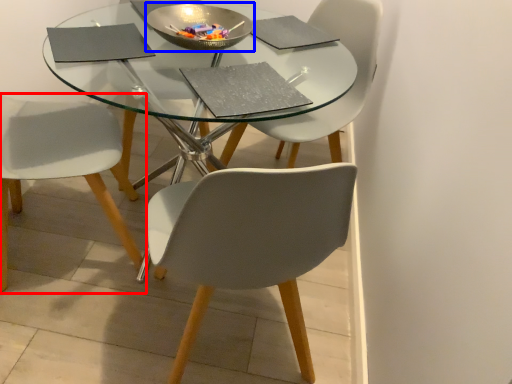
Question: Among these objects, which one is farthest to the camera, chair (highlighted by a red box) or bowl (highlighted by a blue box)?

Choices:
 (A) chair
 (B) bowl

Answer: (B)